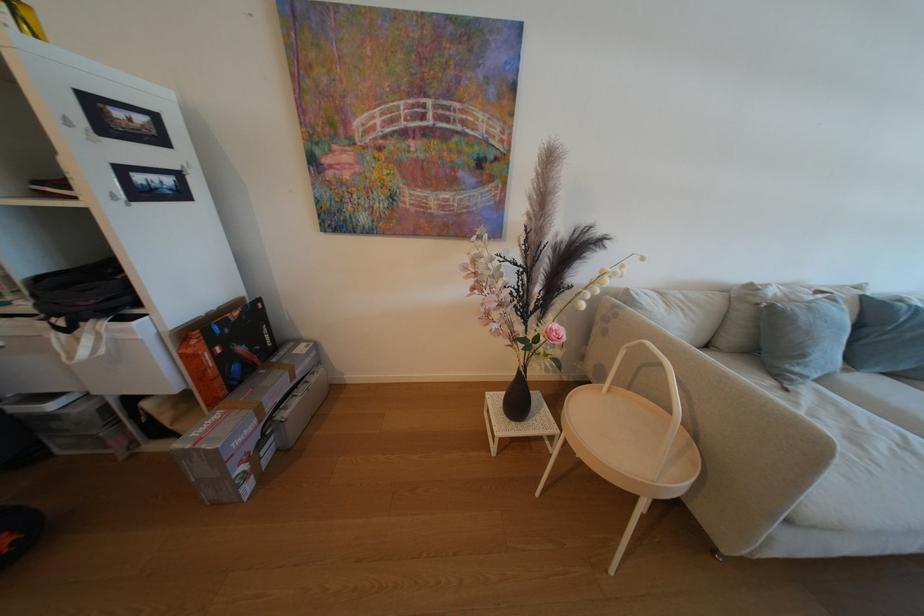
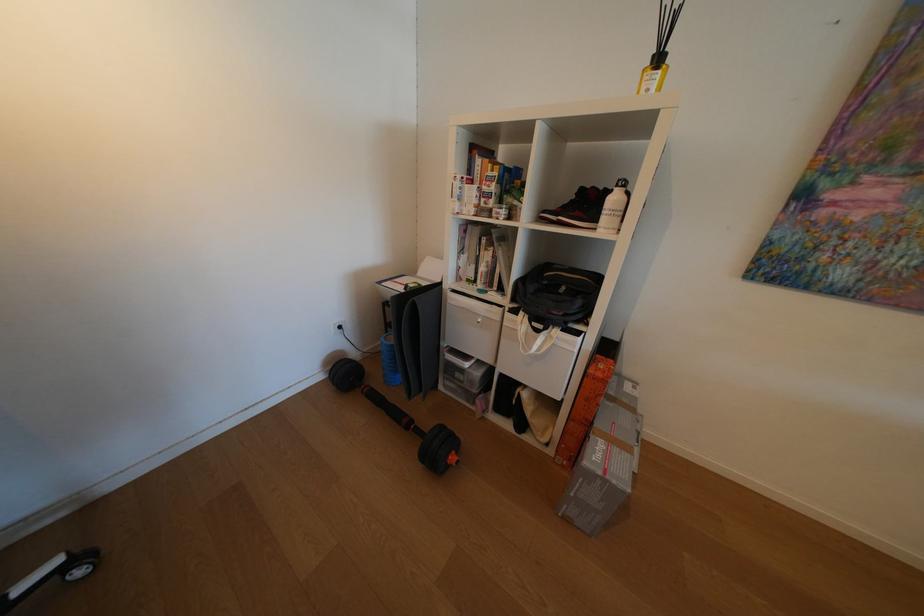
In the second image, find the point that corresponds to (79,331) in the first image.

(548, 331)